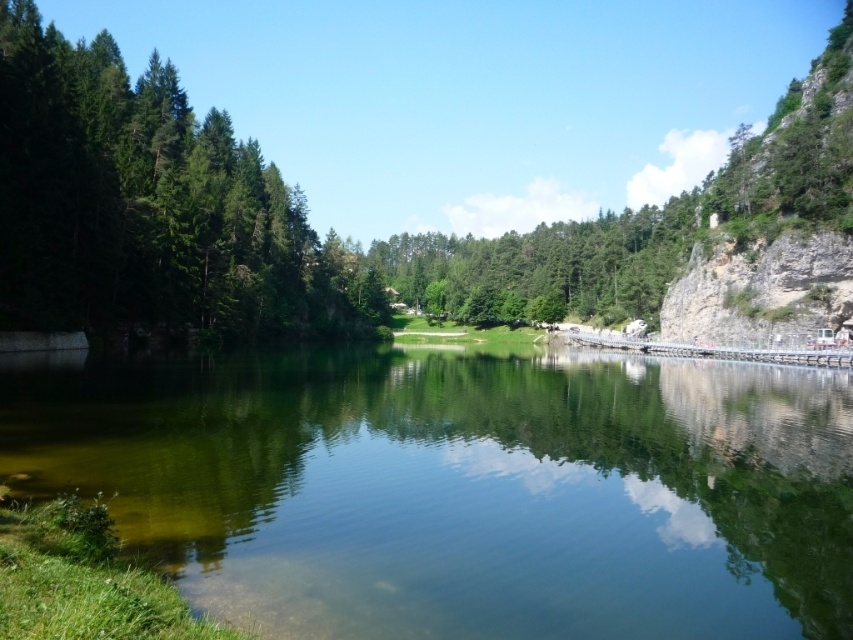
Question: Can you confirm if green reflective water at center is wider than green matte tree at center?

Choices:
 (A) yes
 (B) no

Answer: (B)

Question: Estimate the real-world distances between objects in this image. Which object is closer to the green matte trees at left?

Choices:
 (A) green reflective water at center
 (B) green matte tree at center

Answer: (B)

Question: Can you confirm if green reflective water at center is positioned above green matte trees at left?

Choices:
 (A) yes
 (B) no

Answer: (B)

Question: Can you confirm if green reflective water at center is positioned to the left of green matte tree at center?

Choices:
 (A) yes
 (B) no

Answer: (A)

Question: Based on their relative distances, which object is nearer to the green matte tree at center?

Choices:
 (A) green reflective water at center
 (B) green matte trees at left

Answer: (B)

Question: Which point is farther to the camera?

Choices:
 (A) green reflective water at center
 (B) green matte tree at center

Answer: (B)